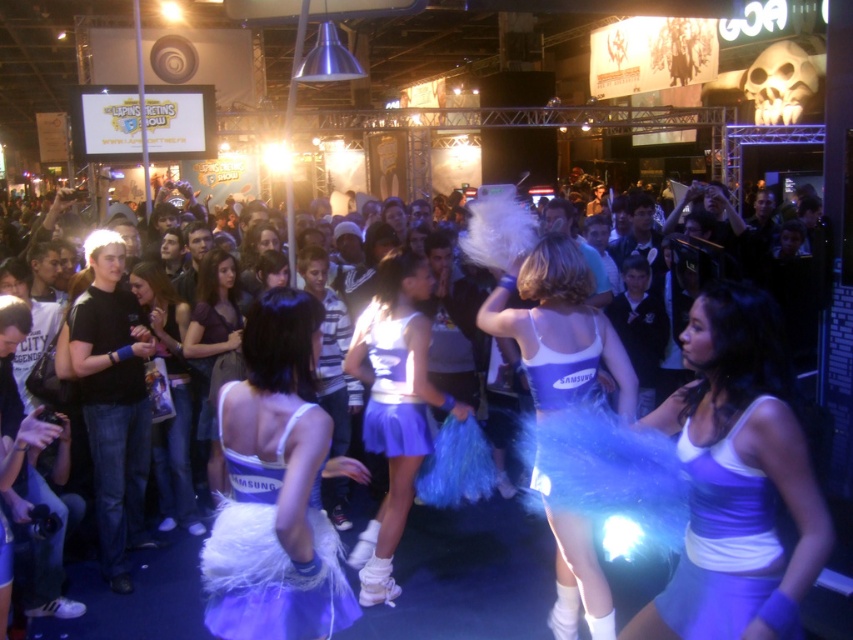
Who is higher up, white satin dress at center or matte blue tutu at center?

Positioned higher is matte blue tutu at center.

Does white satin dress at center have a smaller size compared to matte blue tutu at center?

Incorrect, white satin dress at center is not smaller in size than matte blue tutu at center.

Does point (263, 508) lie in front of point (730, 529)?

No, (263, 508) is further to viewer.

Where is `white satin dress at center`? The image size is (853, 640). white satin dress at center is located at coordinates click(273, 531).

Can you confirm if white fluffy pom-poms at center is positioned above matte purple tutu at center?

No, white fluffy pom-poms at center is not above matte purple tutu at center.

Between white fluffy pom-poms at center and matte purple tutu at center, which one has less height?

white fluffy pom-poms at center is shorter.

Locate an element on the screen. white fluffy pom-poms at center is located at coordinates (467, 577).

Does point (703, 532) come farther from viewer compared to point (407, 413)?

That is False.

Identify the location of matte blue tutu at center. The width and height of the screenshot is (853, 640). (726, 545).